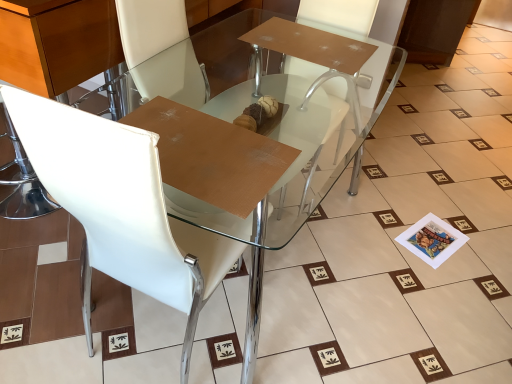
Question: Should I look upward or downward to see white leather armchair at center?

Choices:
 (A) up
 (B) down

Answer: (A)

Question: Is white leather armchair at center smaller than white leather chair at upper left?

Choices:
 (A) no
 (B) yes

Answer: (B)

Question: Is white leather armchair at center at the right side of white leather chair at upper left?

Choices:
 (A) no
 (B) yes

Answer: (B)

Question: Is white leather armchair at center positioned before white leather chair at upper left?

Choices:
 (A) no
 (B) yes

Answer: (A)

Question: Is white leather armchair at center taller than white leather chair at upper left?

Choices:
 (A) no
 (B) yes

Answer: (A)

Question: Can you confirm if white leather armchair at center is positioned to the left of white leather chair at upper left?

Choices:
 (A) yes
 (B) no

Answer: (B)

Question: From a real-world perspective, is white leather armchair at center physically below white leather chair at upper left?

Choices:
 (A) yes
 (B) no

Answer: (A)

Question: Would you consider transparent glass table at center to be distant from white leather armchair at center?

Choices:
 (A) no
 (B) yes

Answer: (A)

Question: Are transparent glass table at center and white leather armchair at center making contact?

Choices:
 (A) yes
 (B) no

Answer: (B)

Question: Does transparent glass table at center turn towards white leather armchair at center?

Choices:
 (A) yes
 (B) no

Answer: (B)

Question: Is transparent glass table at center turned away from white leather armchair at center?

Choices:
 (A) no
 (B) yes

Answer: (B)

Question: Can you confirm if transparent glass table at center is positioned to the left of white leather armchair at center?

Choices:
 (A) no
 (B) yes

Answer: (B)

Question: Is transparent glass table at center to the right of white leather armchair at center from the viewer's perspective?

Choices:
 (A) no
 (B) yes

Answer: (A)

Question: Is transparent glass table at center at the right side of white leather chair at upper left?

Choices:
 (A) yes
 (B) no

Answer: (A)